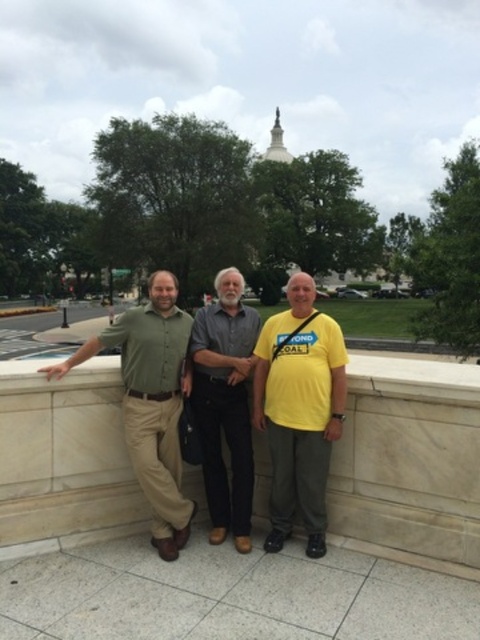
You are a photographer trying to capture a photo of the yellow matte shirt at center and the white marble ledge at center. Since you want both subjects to be in focus, which one should you focus on first to ensure the other is also sharp?

You should focus on the white marble ledge at center first because it is closer to the viewer than the yellow matte shirt at center. By focusing on the closer object, the depth of field will naturally include the farther object in acceptable focus.